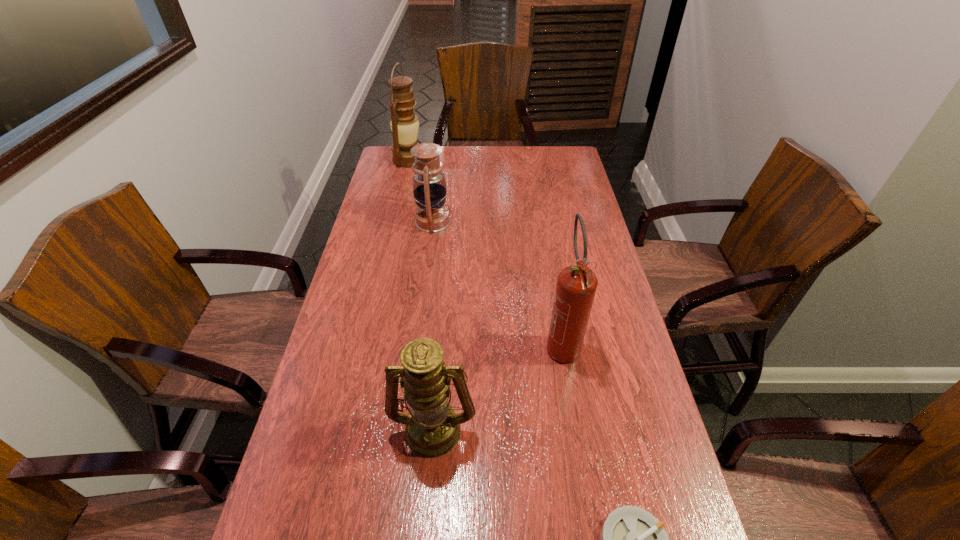
Locate an element on the screen. This screenshot has height=540, width=960. object positioned at the left edge is located at coordinates (404, 124).

You are a GUI agent. You are given a task and a screenshot of the screen. Output one action in this format:
    pyautogui.click(x=<x>, y=<y>)
    Task: Click on the object at the right edge
    The height and width of the screenshot is (540, 960).
    Given the screenshot: What is the action you would take?
    pyautogui.click(x=576, y=286)

The width and height of the screenshot is (960, 540). Identify the location of object positioned at the far left corner. (404, 124).

In the image, there is a desktop. At what (x,y) coordinates should I click in order to perform the action: click on free region at the far edge. Please return your answer as a coordinate pair (x, y). Looking at the image, I should click on (528, 160).

Where is `vacant space at the left edge of the desktop`? Image resolution: width=960 pixels, height=540 pixels. vacant space at the left edge of the desktop is located at coordinates (363, 233).

This screenshot has width=960, height=540. Identify the location of vacant space at the right edge of the desktop. (564, 225).

Image resolution: width=960 pixels, height=540 pixels. In the image, there is a desktop. What are the coordinates of `vacant space at the far left corner` in the screenshot? It's located at (391, 165).

I want to click on unoccupied area between the fire extinguisher and the nearest oil lamp, so click(497, 385).

You are a GUI agent. You are given a task and a screenshot of the screen. Output one action in this format:
    pyautogui.click(x=<x>, y=<y>)
    Task: Click on the free space between the second farthest oil lamp and the third farthest object
    
    Given the screenshot: What is the action you would take?
    pyautogui.click(x=497, y=282)

Image resolution: width=960 pixels, height=540 pixels. Identify the location of free space between the second nearest oil lamp and the nearest oil lamp. [x=433, y=325].